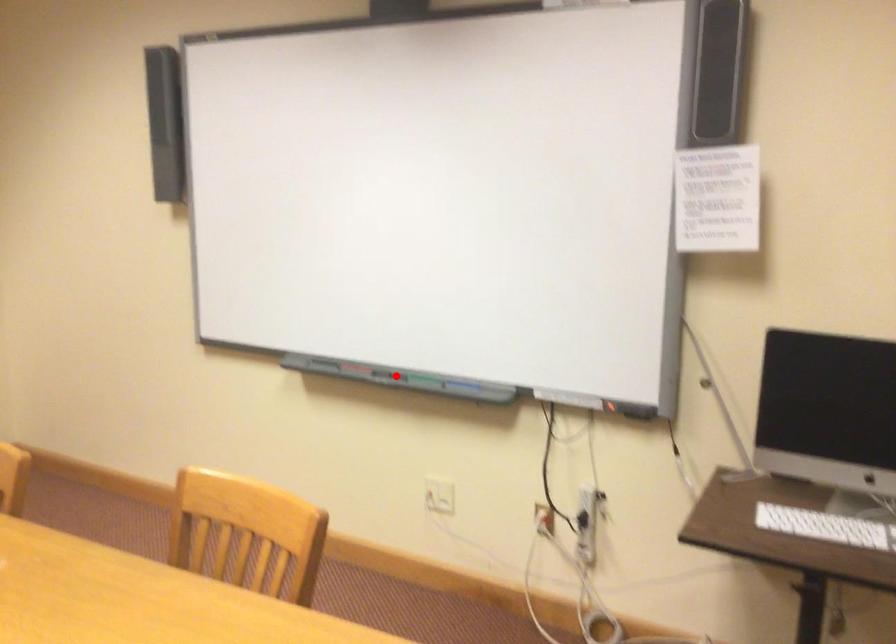
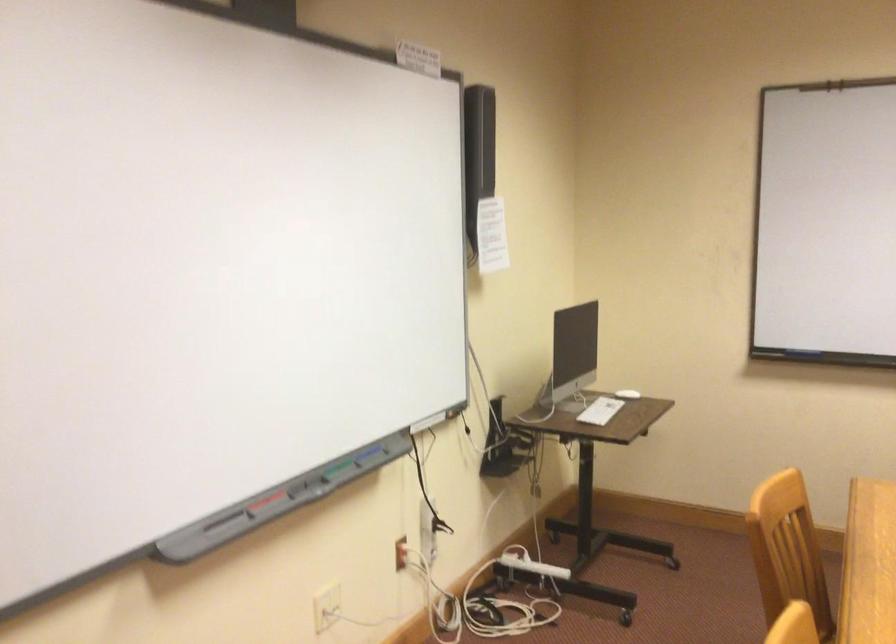
In the second image, find the point that corresponds to the highlighted location in the first image.

(302, 484)